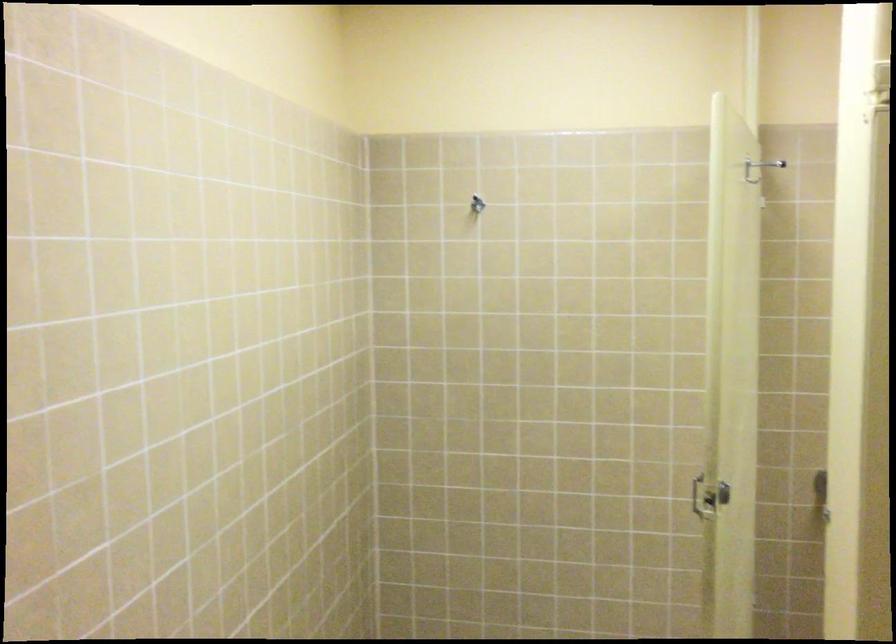
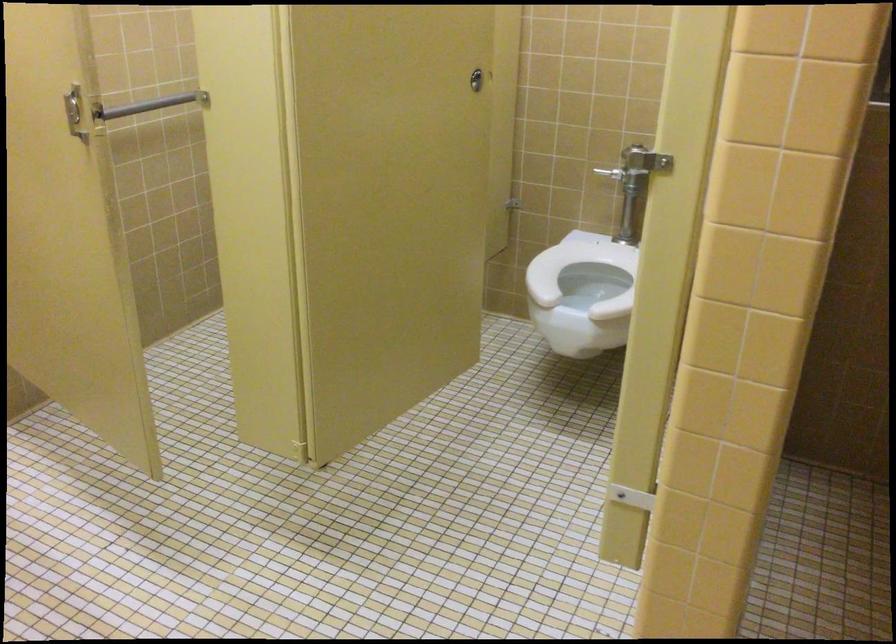
Find the pixel in the second image that matches pixel 703 467 in the first image.

(74, 111)